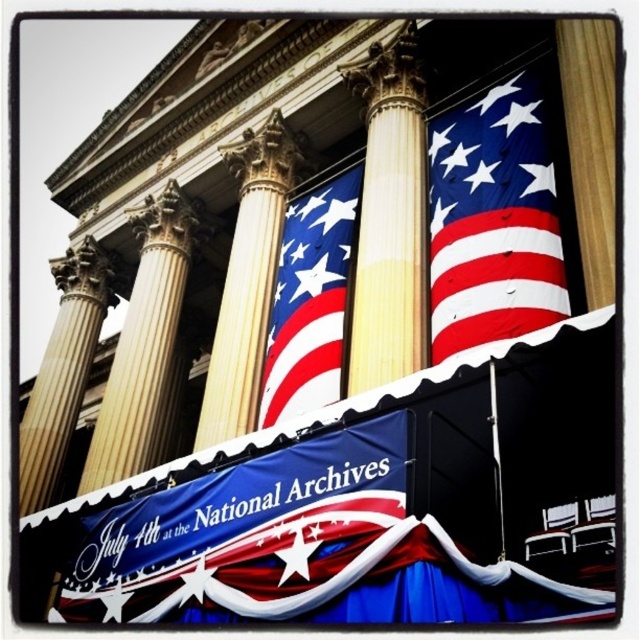
Looking at this image, measure the distance from blue fabric banner at center to golden polished column at center.

23.39 meters

Is blue fabric banner at center above golden polished column at center?

No.

This screenshot has height=640, width=640. What do you see at coordinates (248, 534) in the screenshot?
I see `blue fabric banner at center` at bounding box center [248, 534].

Where is `blue fabric banner at center`? This screenshot has height=640, width=640. blue fabric banner at center is located at coordinates (248, 534).

Who is positioned more to the left, polyester american flag at upper right or golden marble pillar at left?

Positioned to the left is golden marble pillar at left.

Between polyester american flag at upper right and golden marble pillar at left, which one appears on the right side from the viewer's perspective?

Positioned to the right is polyester american flag at upper right.

You are a GUI agent. You are given a task and a screenshot of the screen. Output one action in this format:
    pyautogui.click(x=<x>, y=<y>)
    Task: Click on the polyester american flag at upper right
    
    Given the screenshot: What is the action you would take?
    pyautogui.click(x=492, y=220)

Can you confirm if blue fabric banner at center is positioned below smooth cream-colored column at center?

Indeed, blue fabric banner at center is positioned under smooth cream-colored column at center.

Can you confirm if blue fabric banner at center is smaller than smooth cream-colored column at center?

No.

Does point (387, 449) come farther from viewer compared to point (394, 36)?

No.

The height and width of the screenshot is (640, 640). I want to click on blue fabric banner at center, so click(248, 534).